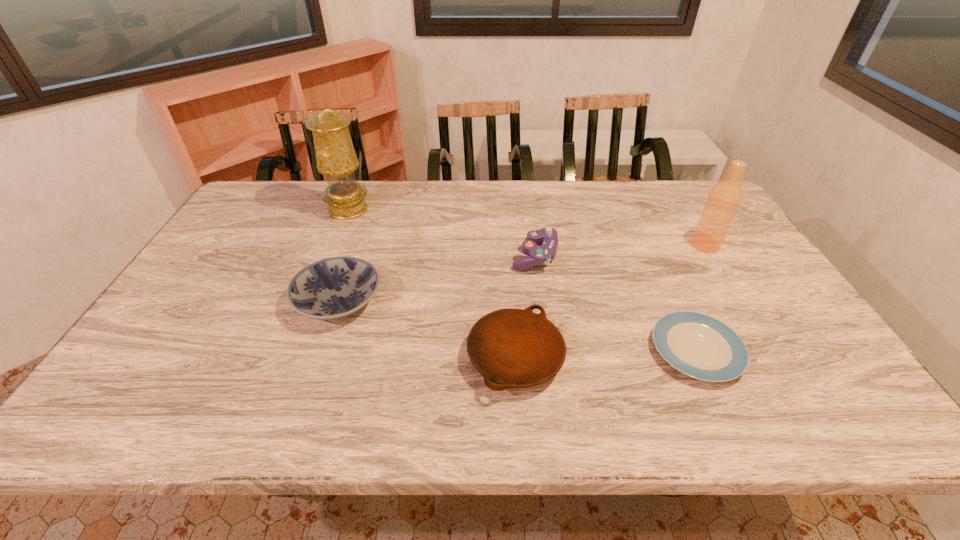
Locate an element on the screen. The height and width of the screenshot is (540, 960). the tallest object is located at coordinates (336, 159).

Locate an element on the screen. the farthest object is located at coordinates (336, 159).

You are a GUI agent. You are given a task and a screenshot of the screen. Output one action in this format:
    pyautogui.click(x=<x>, y=<y>)
    Task: Click on the second tallest object
    This screenshot has width=960, height=540.
    Given the screenshot: What is the action you would take?
    pyautogui.click(x=722, y=203)

Find the location of `beer bottle`. beer bottle is located at coordinates (722, 203).

At what (x,y) coordinates should I click in order to perform the action: click on control. Please return your answer as a coordinate pair (x, y). This screenshot has height=540, width=960. Looking at the image, I should click on click(x=537, y=255).

Find the location of `the leftmost plate`. the leftmost plate is located at coordinates [332, 288].

Locate an element on the screen. This screenshot has width=960, height=540. the second plate from left to right is located at coordinates (511, 348).

The width and height of the screenshot is (960, 540). I want to click on the shortest object, so coord(698,345).

The image size is (960, 540). I want to click on the second object from right to left, so click(698, 345).

Locate an element on the screen. The width and height of the screenshot is (960, 540). free region located on the left of the farthest object is located at coordinates (309, 210).